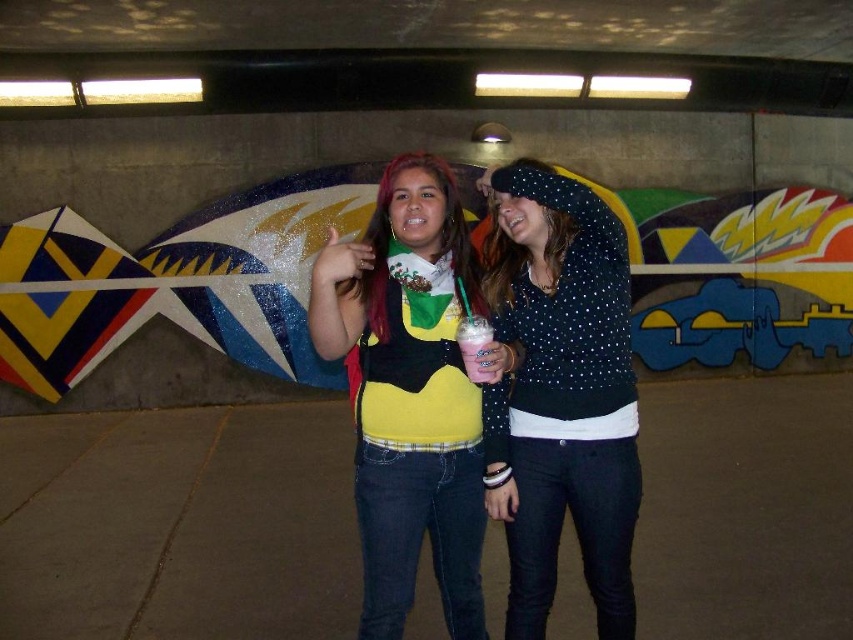
From the picture: Can you confirm if polka dot sweater at center is thinner than matte yellow sweater at center?

Yes.

Who is lower down, polka dot sweater at center or matte yellow sweater at center?

polka dot sweater at center is below.

Which is behind, point (608, 628) or point (323, 292)?

The point (608, 628) is behind.

At what (x,y) coordinates should I click in order to perform the action: click on polka dot sweater at center. Please return your answer as a coordinate pair (x, y). This screenshot has width=853, height=640. Looking at the image, I should click on (561, 396).